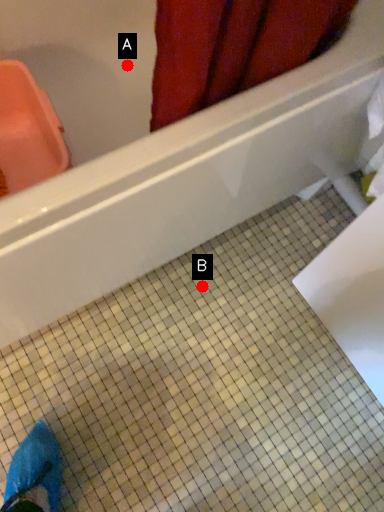
Question: Two points are circled on the image, labeled by A and B beside each circle. Which point is closer to the camera?

Choices:
 (A) A is closer
 (B) B is closer

Answer: (A)